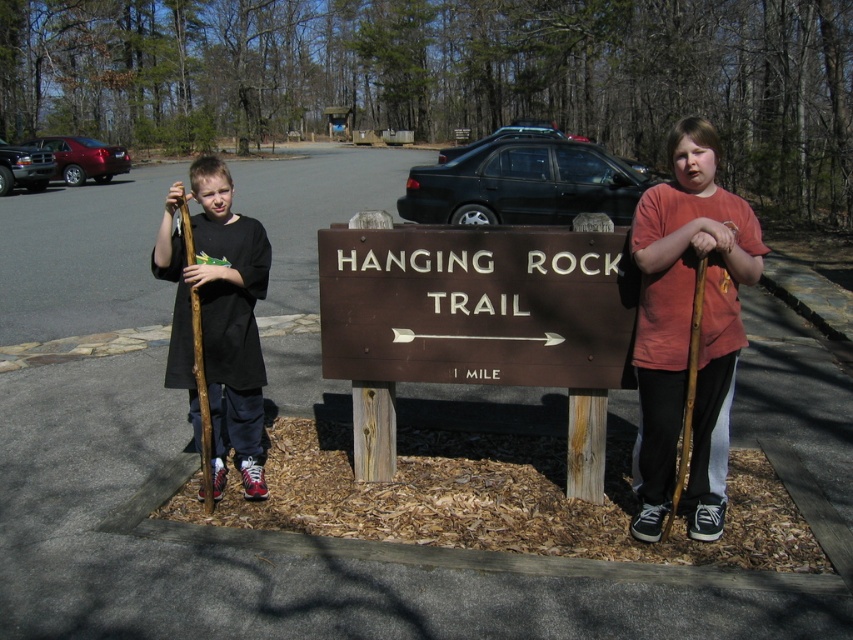
You are a parent trying to ensure your children have the right gear for their hike. You notice the wooden stick at right and the matte black shirt at left. Which item is more suitable for use as a walking aid during the hike?

The wooden stick at right is larger in size than the matte black shirt at left, making it more suitable for use as a walking aid during the hike.

You are a hiker who wants to know the distance between the brown wooden sign at center and the brown rough wooden stick at left. Can you tell me how far apart they are?

The brown wooden sign at center is 1.13 meters from brown rough wooden stick at left.

You are a hiker planning to follow the Hanging Rock Trail. You see the brown wooden sign at center and the brown rough wooden stick at left. Which object is closer to your current position?

The brown rough wooden stick at left is closer to your current position because the brown wooden sign at center is positioned over it, meaning the sign is farther away.